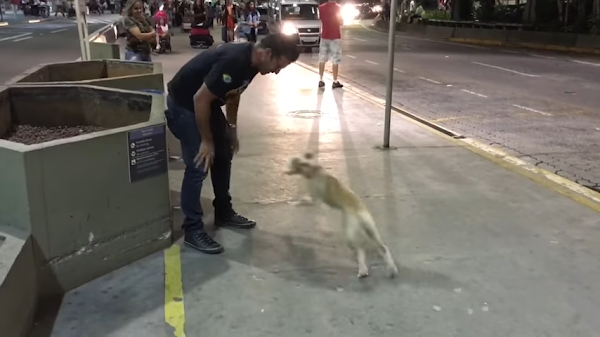
Find the location of a particular element. Image resolution: width=600 pixels, height=337 pixels. sign on planter is located at coordinates (143, 165).